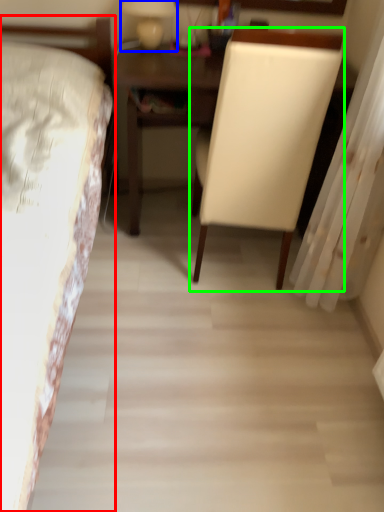
Question: Which object is positioned farthest from bed (highlighted by a red box)? Select from bedside lamp (highlighted by a blue box) and chair (highlighted by a green box).

Choices:
 (A) bedside lamp
 (B) chair

Answer: (A)